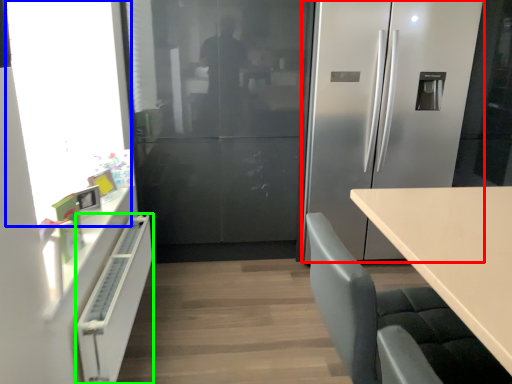
Question: Estimate the real-world distances between objects in this image. Which object is closer to refrigerator (highlighted by a red box), window screen (highlighted by a blue box) or cabinetry (highlighted by a green box)?

Choices:
 (A) window screen
 (B) cabinetry

Answer: (A)